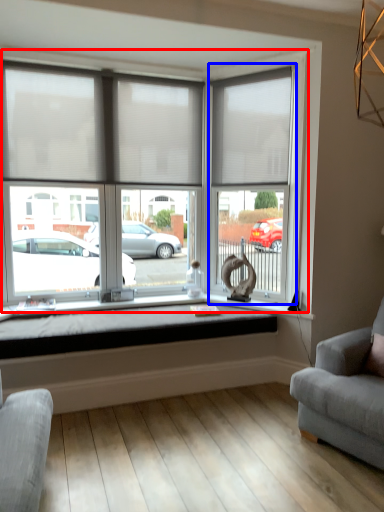
Question: Which point is closer to the camera, window (highlighted by a red box) or glass door (highlighted by a blue box)?

Choices:
 (A) window
 (B) glass door

Answer: (A)